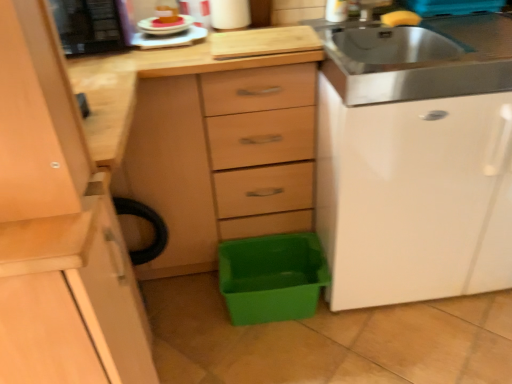
Locate an element on the screen. Image resolution: width=512 pixels, height=384 pixels. white glossy plate at upper center, which is counted as the second appliance, starting from the left is located at coordinates (167, 33).

Describe the element at coordinates (414, 197) in the screenshot. I see `white glossy file cabinet at right` at that location.

What do you see at coordinates (272, 277) in the screenshot? I see `green plastic storage box at lower center` at bounding box center [272, 277].

Find the location of a particular element. This screenshot has height=384, width=512. pink frosted cake at upper left, placed as the second food when sorted from right to left is located at coordinates tap(167, 21).

Which object is positioned more to the left, stainless steel sink at upper right or green plastic storage box at lower center?

green plastic storage box at lower center is more to the left.

Is green plastic storage box at lower center at the back of stainless steel sink at upper right?

No.

Consider the image. Can you tell me how much stainless steel sink at upper right and green plastic storage box at lower center differ in facing direction?

stainless steel sink at upper right and green plastic storage box at lower center are facing 0.919 degrees away from each other.

The height and width of the screenshot is (384, 512). What are the coordinates of `storage box below the stainless steel sink at upper right (from the image's perspective)` in the screenshot? It's located at (272, 277).

Is green plastic storage box at lower center with matte wood chest of drawers at center?

green plastic storage box at lower center and matte wood chest of drawers at center are clearly separated.

Is green plastic storage box at lower center spatially inside matte wood chest of drawers at center, or outside of it?

The correct answer is: outside.

Based on their sizes in the image, would you say green plastic storage box at lower center is bigger or smaller than matte wood chest of drawers at center?

green plastic storage box at lower center is smaller than matte wood chest of drawers at center.

Between black plastic microwave at upper left, which ranks as the 2th appliance in right-to-left order, and white glossy file cabinet at right, which one appears on the left side from the viewer's perspective?

From the viewer's perspective, black plastic microwave at upper left, which ranks as the 2th appliance in right-to-left order, appears more on the left side.

Considering their positions, is black plastic microwave at upper left, marked as the first appliance in a left-to-right arrangement, located in front of or behind white glossy file cabinet at right?

black plastic microwave at upper left, marked as the first appliance in a left-to-right arrangement, is positioned farther from the viewer than white glossy file cabinet at right.

I want to click on file cabinet to the right of black plastic microwave at upper left, which ranks as the 2th appliance in right-to-left order, so click(x=414, y=197).

Between black plastic microwave at upper left, which ranks as the 2th appliance in right-to-left order, and white glossy file cabinet at right, which one has more height?

white glossy file cabinet at right is taller.

Is yellow sponge at upper right, which ranks as the 2th food in left-to-right order, to the left of pink frosted cake at upper left, positioned as the 1th food in left-to-right order, from the viewer's perspective?

Incorrect, yellow sponge at upper right, which ranks as the 2th food in left-to-right order, is not on the left side of pink frosted cake at upper left, positioned as the 1th food in left-to-right order.

How distant is yellow sponge at upper right, which ranks as the 1th food in right-to-left order, from pink frosted cake at upper left, placed as the second food when sorted from right to left?

A distance of 29.34 inches exists between yellow sponge at upper right, which ranks as the 1th food in right-to-left order, and pink frosted cake at upper left, placed as the second food when sorted from right to left.

Between point (407, 23) and point (169, 23), which one is positioned in front?

The point (169, 23) is more forward.

From the image's perspective, is yellow sponge at upper right, which ranks as the 1th food in right-to-left order, beneath pink frosted cake at upper left, positioned as the 1th food in left-to-right order?

Incorrect, from the image's perspective, yellow sponge at upper right, which ranks as the 1th food in right-to-left order, is higher than pink frosted cake at upper left, positioned as the 1th food in left-to-right order.

From the image's perspective, would you say white glossy plate at upper center, which is the first appliance from right to left, is shown under black plastic microwave at upper left, marked as the first appliance in a left-to-right arrangement?

Yes, from the image's perspective, white glossy plate at upper center, which is the first appliance from right to left, is below black plastic microwave at upper left, marked as the first appliance in a left-to-right arrangement.

In the scene shown: From a real-world perspective, between white glossy plate at upper center, which is counted as the second appliance, starting from the left, and black plastic microwave at upper left, which ranks as the 2th appliance in right-to-left order, who is vertically higher?

black plastic microwave at upper left, which ranks as the 2th appliance in right-to-left order.

Which of these two, white glossy plate at upper center, which is the first appliance from right to left, or black plastic microwave at upper left, which ranks as the 2th appliance in right-to-left order, is wider?

Wider between the two is black plastic microwave at upper left, which ranks as the 2th appliance in right-to-left order.

Which of these two, white glossy plate at upper center, which is the first appliance from right to left, or black plastic microwave at upper left, marked as the first appliance in a left-to-right arrangement, stands taller?

black plastic microwave at upper left, marked as the first appliance in a left-to-right arrangement.

Can you confirm if white glossy plate at upper center, which is counted as the second appliance, starting from the left, is positioned to the left of stainless steel sink at upper right?

Yes, white glossy plate at upper center, which is counted as the second appliance, starting from the left, is to the left of stainless steel sink at upper right.

Does white glossy plate at upper center, which is the first appliance from right to left, have a greater height compared to stainless steel sink at upper right?

In fact, white glossy plate at upper center, which is the first appliance from right to left, may be shorter than stainless steel sink at upper right.

Is white glossy plate at upper center, which is the first appliance from right to left, looking in the opposite direction of stainless steel sink at upper right?

No.

In terms of width, does white glossy plate at upper center, which is counted as the second appliance, starting from the left, look wider or thinner when compared to stainless steel sink at upper right?

white glossy plate at upper center, which is counted as the second appliance, starting from the left, is thinner than stainless steel sink at upper right.

Looking at this image, how distant is pink frosted cake at upper left, positioned as the 1th food in left-to-right order, from yellow sponge at upper right, which ranks as the 2th food in left-to-right order?

pink frosted cake at upper left, positioned as the 1th food in left-to-right order, and yellow sponge at upper right, which ranks as the 2th food in left-to-right order, are 29.34 inches apart.

At what (x,y) coordinates should I click in order to perform the action: click on food lying above the pink frosted cake at upper left, positioned as the 1th food in left-to-right order (from the image's perspective). Please return your answer as a coordinate pair (x, y). The width and height of the screenshot is (512, 384). Looking at the image, I should click on (400, 18).

Would you say pink frosted cake at upper left, positioned as the 1th food in left-to-right order, is outside yellow sponge at upper right, which ranks as the 2th food in left-to-right order?

Yes, pink frosted cake at upper left, positioned as the 1th food in left-to-right order, is not within yellow sponge at upper right, which ranks as the 2th food in left-to-right order.

Is pink frosted cake at upper left, positioned as the 1th food in left-to-right order, facing away from yellow sponge at upper right, which ranks as the 1th food in right-to-left order?

pink frosted cake at upper left, positioned as the 1th food in left-to-right order, is not turned away from yellow sponge at upper right, which ranks as the 1th food in right-to-left order.

Locate an element on the screen. This screenshot has height=384, width=512. sink above the green plastic storage box at lower center (from a real-world perspective) is located at coordinates (418, 58).

You are a GUI agent. You are given a task and a screenshot of the screen. Output one action in this format:
    pyautogui.click(x=<x>, y=<y>)
    Task: Click on the chest of drawers on the left of green plastic storage box at lower center
    This screenshot has width=512, height=384.
    Given the screenshot: What is the action you would take?
    pyautogui.click(x=223, y=159)

When comparing their distances from pink frosted cake at upper left, placed as the second food when sorted from right to left, does stainless steel sink at upper right or white glossy plate at upper center, which is counted as the second appliance, starting from the left, seem closer?

white glossy plate at upper center, which is counted as the second appliance, starting from the left, lies closer to pink frosted cake at upper left, placed as the second food when sorted from right to left, than the other object.

Looking at the image, which one is located further to yellow sponge at upper right, which ranks as the 2th food in left-to-right order, matte wood chest of drawers at center or stainless steel sink at upper right?

matte wood chest of drawers at center.

Based on their spatial positions, is matte wood chest of drawers at center or black plastic microwave at upper left, which ranks as the 2th appliance in right-to-left order, further from pink frosted cake at upper left, placed as the second food when sorted from right to left?

Among the two, matte wood chest of drawers at center is located further to pink frosted cake at upper left, placed as the second food when sorted from right to left.

From the picture: Which object lies nearer to the anchor point green plastic storage box at lower center, yellow sponge at upper right, which ranks as the 2th food in left-to-right order, or white glossy plate at upper center, which is the first appliance from right to left?

white glossy plate at upper center, which is the first appliance from right to left, is closer to green plastic storage box at lower center.

Estimate the real-world distances between objects in this image. Which object is closer to pink frosted cake at upper left, placed as the second food when sorted from right to left, matte wood chest of drawers at center or green plastic storage box at lower center?

Among the two, matte wood chest of drawers at center is located nearer to pink frosted cake at upper left, placed as the second food when sorted from right to left.

When comparing their distances from pink frosted cake at upper left, placed as the second food when sorted from right to left, does black plastic microwave at upper left, which ranks as the 2th appliance in right-to-left order, or stainless steel sink at upper right seem further?

Based on the image, stainless steel sink at upper right appears to be further to pink frosted cake at upper left, placed as the second food when sorted from right to left.

Looking at the image, which one is located closer to black plastic microwave at upper left, which ranks as the 2th appliance in right-to-left order, matte wood chest of drawers at center or green plastic storage box at lower center?

The object closer to black plastic microwave at upper left, which ranks as the 2th appliance in right-to-left order, is matte wood chest of drawers at center.

Based on their spatial positions, is yellow sponge at upper right, which ranks as the 2th food in left-to-right order, or green plastic storage box at lower center further from matte wood chest of drawers at center?

yellow sponge at upper right, which ranks as the 2th food in left-to-right order, lies further to matte wood chest of drawers at center than the other object.

Image resolution: width=512 pixels, height=384 pixels. Identify the location of storage box situated between white glossy plate at upper center, which is counted as the second appliance, starting from the left, and white glossy file cabinet at right from left to right. (272, 277).

Where is `food between white glossy plate at upper center, which is counted as the second appliance, starting from the left, and white glossy file cabinet at right, in the horizontal direction`? This screenshot has width=512, height=384. food between white glossy plate at upper center, which is counted as the second appliance, starting from the left, and white glossy file cabinet at right, in the horizontal direction is located at coordinates (400, 18).

Identify the location of food situated between matte wood chest of drawers at center and white glossy file cabinet at right from left to right. (400, 18).

Image resolution: width=512 pixels, height=384 pixels. Find the location of `file cabinet between yellow sponge at upper right, which ranks as the 1th food in right-to-left order, and green plastic storage box at lower center from top to bottom`. file cabinet between yellow sponge at upper right, which ranks as the 1th food in right-to-left order, and green plastic storage box at lower center from top to bottom is located at coordinates (414, 197).